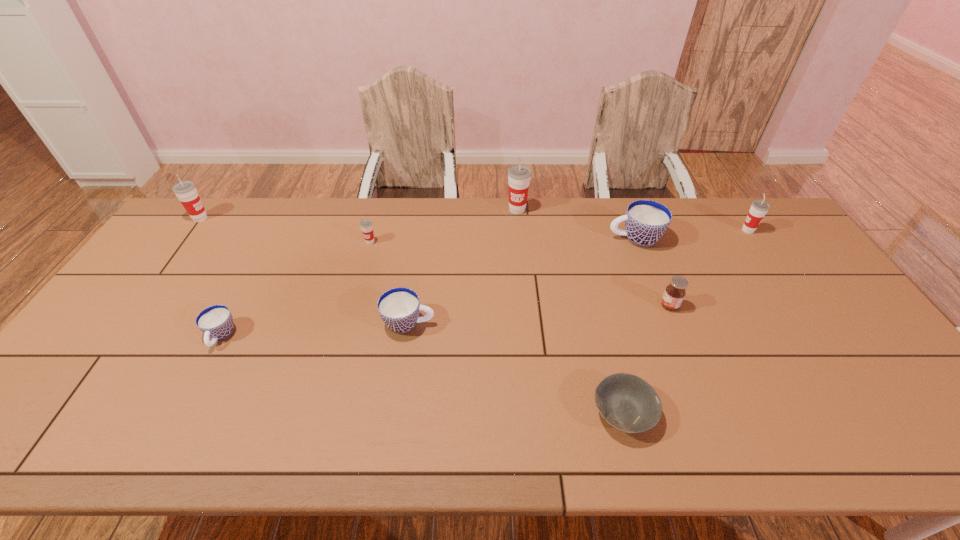
Where is `jam`? jam is located at coordinates click(675, 292).

You are a GUI agent. You are given a task and a screenshot of the screen. Output one action in this format:
    pyautogui.click(x=<x>, y=<y>)
    Task: Click on the fourth cup from left to right
    The image size is (960, 540).
    Given the screenshot: What is the action you would take?
    pyautogui.click(x=399, y=307)

Locate an element on the screen. The width and height of the screenshot is (960, 540). the fourth object from left to right is located at coordinates (399, 307).

The width and height of the screenshot is (960, 540). Find the location of `the smallest blue cup`. the smallest blue cup is located at coordinates tap(216, 322).

Image resolution: width=960 pixels, height=540 pixels. I want to click on the eighth object from right to left, so click(216, 322).

Locate an element on the screen. Image resolution: width=960 pixels, height=540 pixels. gray bowl is located at coordinates (628, 403).

Identify the location of the nearest object. (628, 403).

This screenshot has height=540, width=960. In order to click on free spot located on the side of the tallest cup with the logo in this screenshot , I will do `click(525, 289)`.

What are the coordinates of `free region located 0.300m on the side of the third smallest red cup with the logo` in the screenshot? It's located at (296, 218).

Locate an element on the screen. This screenshot has width=960, height=540. free space located on the side of the rightmost red cup with the logo is located at coordinates click(675, 230).